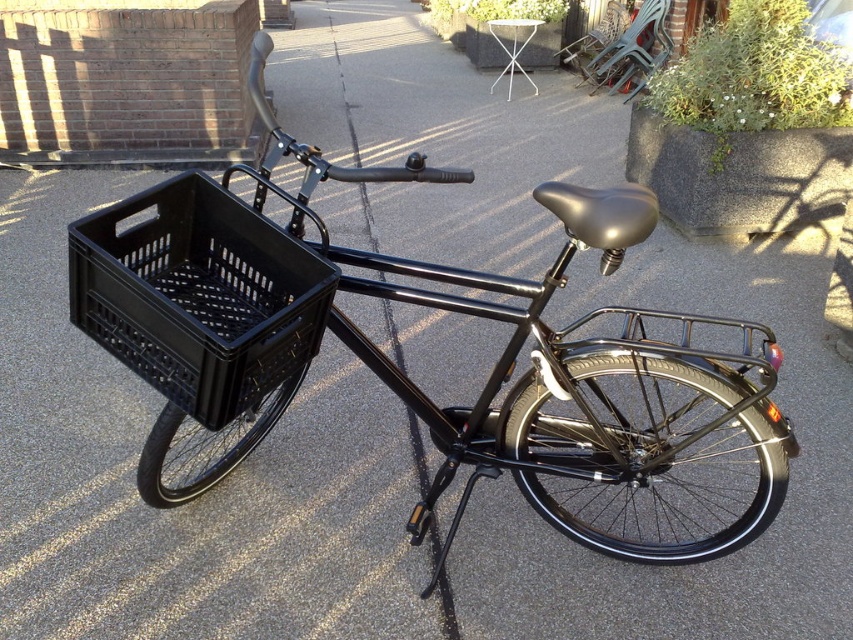
Does black matte bicycle at center have a lesser height compared to black plastic basket at left?

No.

Based on the photo, who is more forward, (608, 273) or (234, 307)?

Point (608, 273) is more forward.

Find the location of `black matte bicycle at center`. black matte bicycle at center is located at coordinates (556, 369).